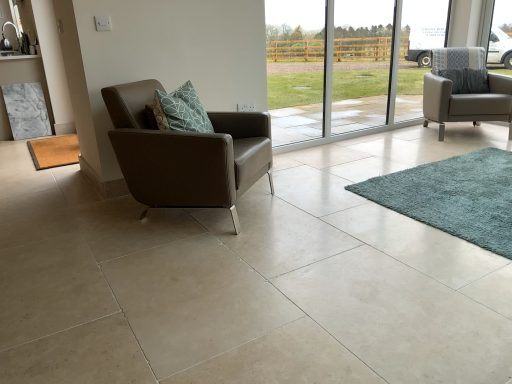
Question: Considering the relative sizes of matte gray armchair at right, the 2th chair positioned from the front, and transparent glass door at center in the image provided, is matte gray armchair at right, the 2th chair positioned from the front, shorter than transparent glass door at center?

Choices:
 (A) no
 (B) yes

Answer: (B)

Question: Can you confirm if matte gray armchair at right, the 2th chair positioned from the front, is thinner than transparent glass door at center?

Choices:
 (A) yes
 (B) no

Answer: (B)

Question: Would you say matte gray armchair at right, the 2th chair positioned from the front, contains transparent glass door at center?

Choices:
 (A) yes
 (B) no

Answer: (B)

Question: Is matte gray armchair at right, the first chair positioned from the right, bigger than transparent glass door at center?

Choices:
 (A) yes
 (B) no

Answer: (A)

Question: From a real-world perspective, is matte gray armchair at right, the first chair positioned from the right, physically above transparent glass door at center?

Choices:
 (A) yes
 (B) no

Answer: (B)

Question: Choose the correct answer: Is teal shaggy rug at lower right, positioned as the 1th mat in right-to-left order, inside transparent glass door at center or outside it?

Choices:
 (A) inside
 (B) outside

Answer: (B)

Question: Considering the positions of teal shaggy rug at lower right, positioned as the 1th mat in right-to-left order, and transparent glass door at center in the image, is teal shaggy rug at lower right, positioned as the 1th mat in right-to-left order, bigger or smaller than transparent glass door at center?

Choices:
 (A) big
 (B) small

Answer: (B)

Question: Considering the relative positions of teal shaggy rug at lower right, which appears as the 2th mat when viewed from the left, and transparent glass door at center in the image provided, is teal shaggy rug at lower right, which appears as the 2th mat when viewed from the left, to the left or to the right of transparent glass door at center?

Choices:
 (A) left
 (B) right

Answer: (B)

Question: From a real-world perspective, relative to transparent glass door at center, is teal shaggy rug at lower right, which appears as the 2th mat when viewed from the left, vertically above or below?

Choices:
 (A) above
 (B) below

Answer: (B)

Question: From the image's perspective, relative to brown leather armchair at left, placed as the second chair when sorted from back to front, is transparent glass door at center above or below?

Choices:
 (A) below
 (B) above

Answer: (B)

Question: From a real-world perspective, is transparent glass door at center positioned above or below brown leather armchair at left, marked as the 1th chair in a left-to-right arrangement?

Choices:
 (A) below
 (B) above

Answer: (B)

Question: Visually, is transparent glass door at center positioned to the left or to the right of brown leather armchair at left, which appears as the second chair when viewed from the right?

Choices:
 (A) left
 (B) right

Answer: (B)

Question: Is transparent glass door at center taller or shorter than brown leather armchair at left, marked as the 1th chair in a left-to-right arrangement?

Choices:
 (A) short
 (B) tall

Answer: (B)

Question: From the image's perspective, is transparent glass door at center above or below brown textured mat at lower left, marked as the 1th mat in a back-to-front arrangement?

Choices:
 (A) above
 (B) below

Answer: (A)

Question: Does point (324, 135) appear closer or farther from the camera than point (33, 142)?

Choices:
 (A) farther
 (B) closer

Answer: (A)